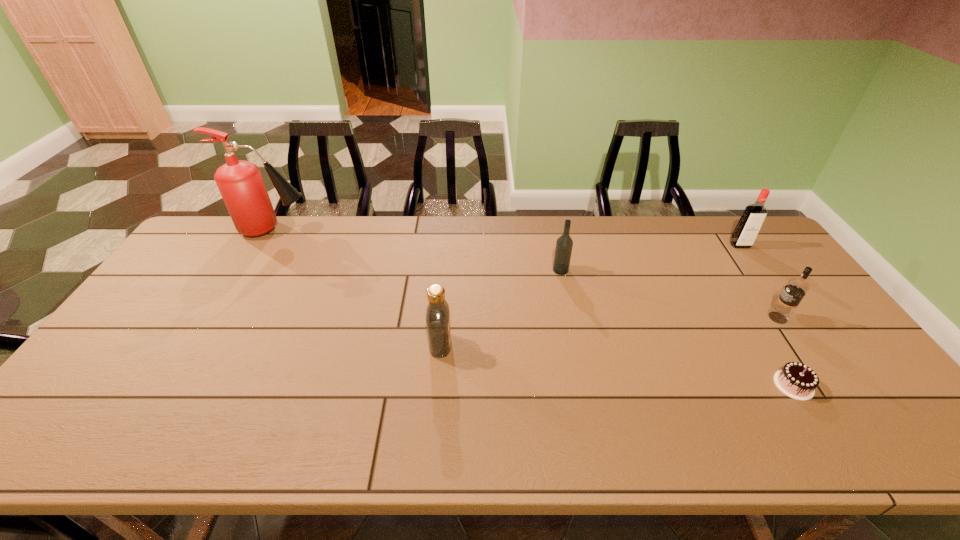
At what (x,y) coordinates should I click in order to perform the action: click on the tallest object. Please return your answer as a coordinate pair (x, y). The height and width of the screenshot is (540, 960). Looking at the image, I should click on (240, 183).

The width and height of the screenshot is (960, 540). In order to click on fire extinguisher in this screenshot , I will do `click(240, 183)`.

Find the location of a particular element. This screenshot has width=960, height=540. the farthest vodka is located at coordinates (749, 225).

Image resolution: width=960 pixels, height=540 pixels. I want to click on the nearest vodka, so click(x=438, y=324).

You are a GUI agent. You are given a task and a screenshot of the screen. Output one action in this format:
    pyautogui.click(x=<x>, y=<y>)
    Task: Click on the fifth farthest object
    
    Given the screenshot: What is the action you would take?
    pyautogui.click(x=438, y=324)

You are a GUI agent. You are given a task and a screenshot of the screen. Output one action in this format:
    pyautogui.click(x=<x>, y=<y>)
    Task: Click on the third object from left to right
    The image size is (960, 540).
    Given the screenshot: What is the action you would take?
    pyautogui.click(x=564, y=244)

What are the coordinates of `the third farthest object` in the screenshot? It's located at (564, 244).

Identify the location of the fourth farthest object. tap(781, 312).

At what (x,y) coordinates should I click in order to perform the action: click on the third object from right to left. Please return your answer as a coordinate pair (x, y). The width and height of the screenshot is (960, 540). Looking at the image, I should click on (796, 380).

At what (x,y) coordinates should I click in order to perform the action: click on the shortest object. Please return your answer as a coordinate pair (x, y). Image resolution: width=960 pixels, height=540 pixels. Looking at the image, I should click on (796, 380).